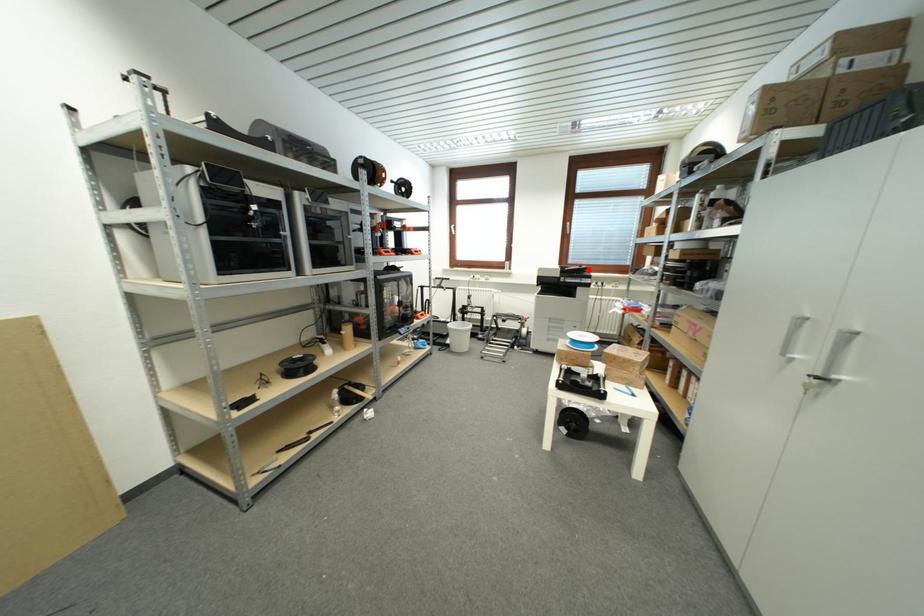
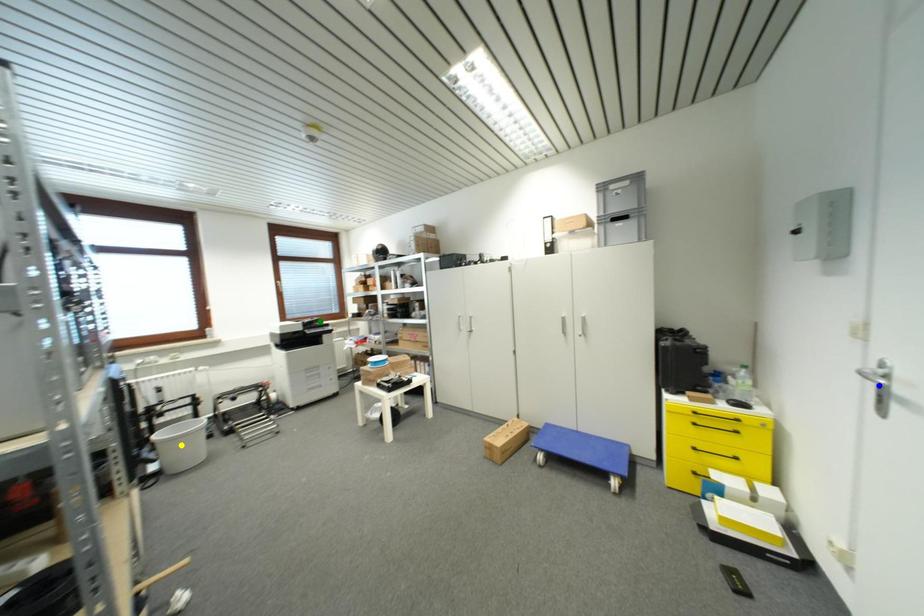
Question: I am providing you with two images of the same scene from different viewpoints. A red point is marked on the first image. You are given multiple points on the second image. Which mark in image 2 goes with the point in image 1?

Choices:
 (A) blue point
 (B) green point
 (C) yellow point

Answer: (B)